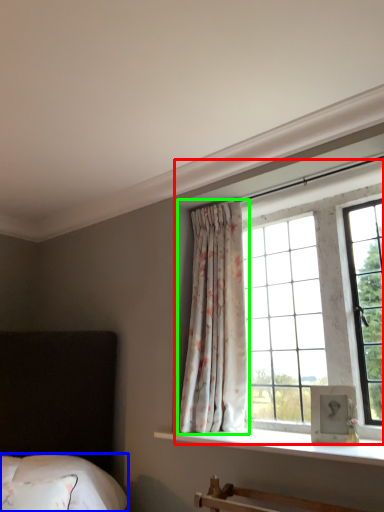
Question: Which object is positioned closest to bay window (highlighted by a red box)? Select from bedding (highlighted by a blue box) and curtain (highlighted by a green box).

Choices:
 (A) bedding
 (B) curtain

Answer: (B)